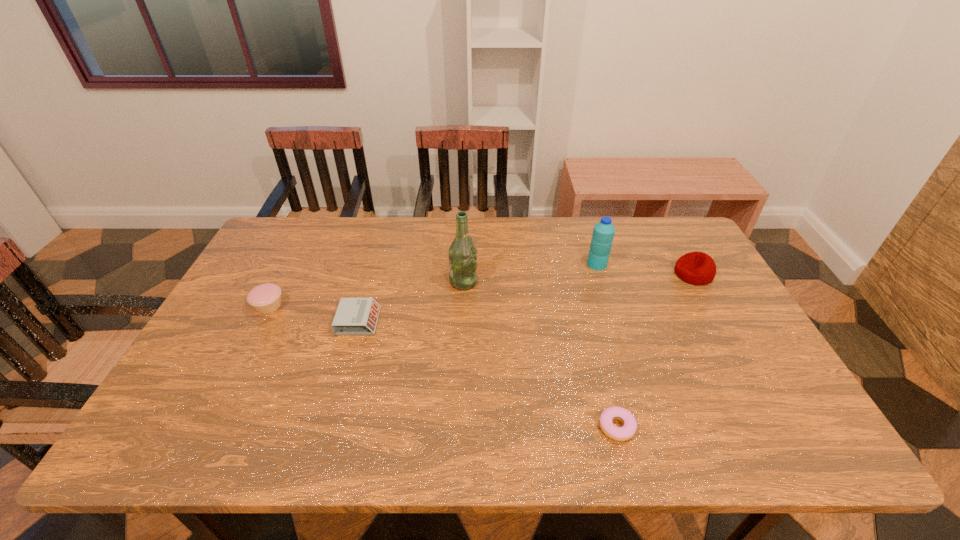
At what (x,y) coordinates should I click in order to perform the action: click on object present at the near edge. Please return your answer as a coordinate pair (x, y). This screenshot has width=960, height=540. Looking at the image, I should click on (627, 431).

Where is `object present at the left edge`? Image resolution: width=960 pixels, height=540 pixels. object present at the left edge is located at coordinates [x=266, y=298].

Locate an element on the screen. The image size is (960, 540). object located in the right edge section of the desktop is located at coordinates (697, 268).

At what (x,y) coordinates should I click in order to perform the action: click on vacant space at the far edge of the desktop. Please return your answer as a coordinate pair (x, y). This screenshot has width=960, height=540. Looking at the image, I should click on (534, 228).

Identify the location of free location at the near edge of the desktop. The width and height of the screenshot is (960, 540). (606, 455).

Identify the location of free location at the left edge of the desktop. pyautogui.click(x=190, y=368).

This screenshot has width=960, height=540. Identify the location of vacant area at the right edge. (696, 333).

You are a GUI agent. You are given a task and a screenshot of the screen. Output one action in this format:
    pyautogui.click(x=<x>, y=<y>)
    Task: Click on the free space at the far left corner
    
    Given the screenshot: What is the action you would take?
    pyautogui.click(x=307, y=219)

I want to click on vacant area between the fourth object from right to left and the alarm clock, so click(411, 301).

Locate an element on the screen. empty space that is in between the rightmost object and the doughnut is located at coordinates (655, 350).